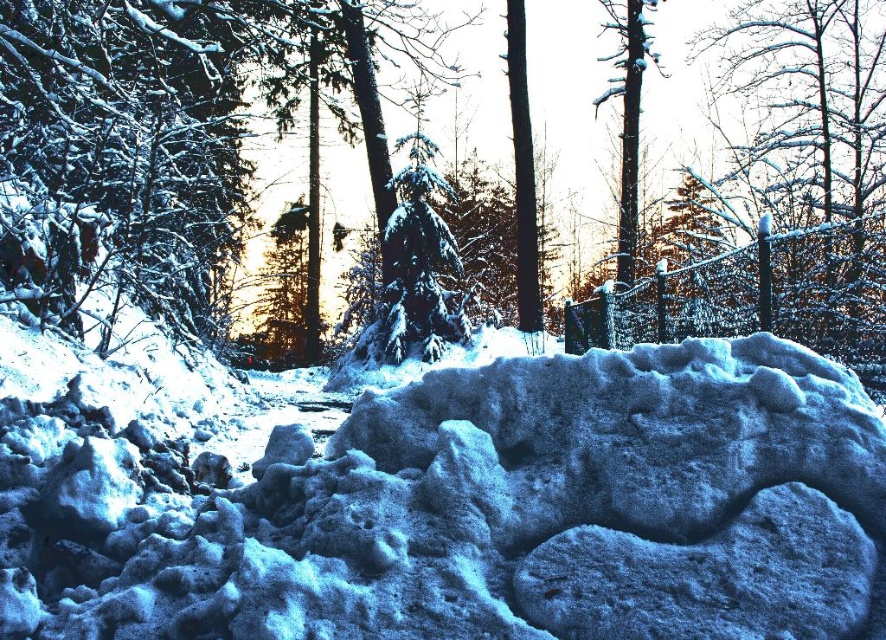
Question: Which of the following is the closest to the observer?

Choices:
 (A) (624, 211)
 (B) (789, 264)
 (C) (48, 621)
 (D) (517, 218)

Answer: (C)

Question: Does white frosty mound at center appear on the left side of smooth bark tree at center?

Choices:
 (A) yes
 (B) no

Answer: (A)

Question: Is white frosty mound at center above smooth bark tree at center?

Choices:
 (A) no
 (B) yes

Answer: (A)

Question: Which object is closer to the camera taking this photo?

Choices:
 (A) white frosty mound at center
 (B) smooth bark tree at center
 (C) white frosty tree at upper right

Answer: (A)

Question: Based on their relative distances, which object is farther from the white frosty tree at upper right?

Choices:
 (A) smooth bark tree at center
 (B) white frosty mound at center
 (C) snow-covered tree trunk at center

Answer: (A)

Question: Is white frosty tree at upper right to the left of smooth bark tree at center from the viewer's perspective?

Choices:
 (A) yes
 (B) no

Answer: (B)